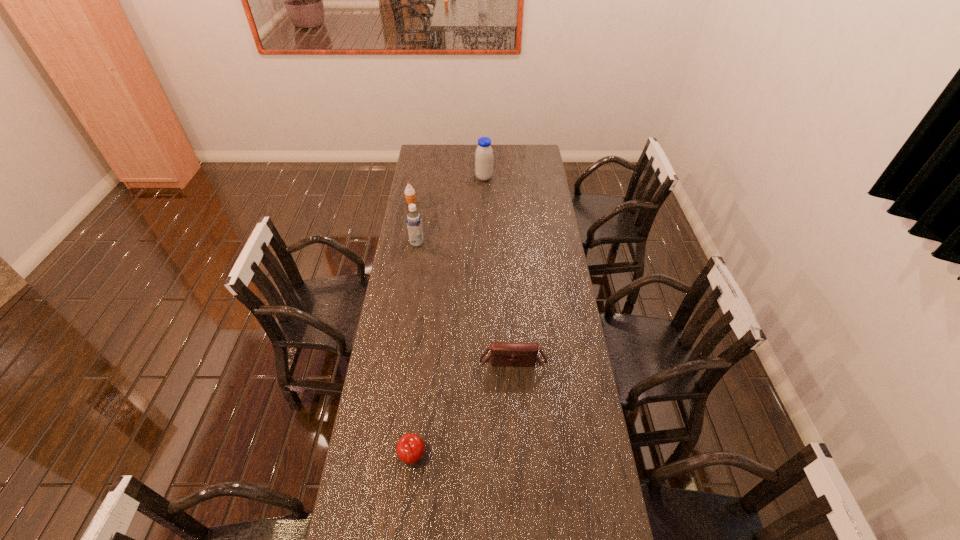
In the image, there is a desktop. Find the location of `vacant space at the far left corner`. vacant space at the far left corner is located at coordinates (434, 157).

Where is `vacant space at the far right corner of the desktop`? vacant space at the far right corner of the desktop is located at coordinates (536, 145).

Where is `empty space between the fourth farthest object and the cherry`? empty space between the fourth farthest object and the cherry is located at coordinates (463, 409).

Where is `free spot between the third object from left to right and the farthest object`? free spot between the third object from left to right and the farthest object is located at coordinates (448, 318).

Locate an element on the screen. empty location between the third object from left to right and the icecream is located at coordinates (412, 330).

Locate an element on the screen. This screenshot has width=960, height=540. empty space that is in between the second nearest object and the icecream is located at coordinates (462, 281).

Find the location of a particular element. vacant area that lies between the second nearest object and the farther soya milk is located at coordinates (498, 268).

Locate an element on the screen. free space between the third object from right to left and the left soya milk is located at coordinates tap(415, 350).

This screenshot has height=540, width=960. I want to click on empty location between the left soya milk and the cherry, so click(415, 350).

The height and width of the screenshot is (540, 960). In order to click on empty location between the shoulder bag and the nearest object in this screenshot , I will do `click(463, 409)`.